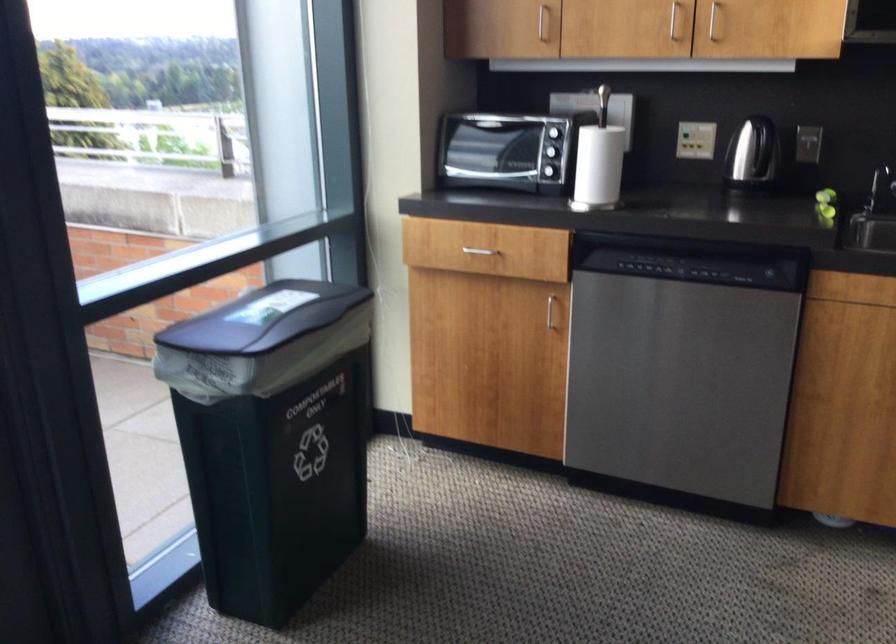
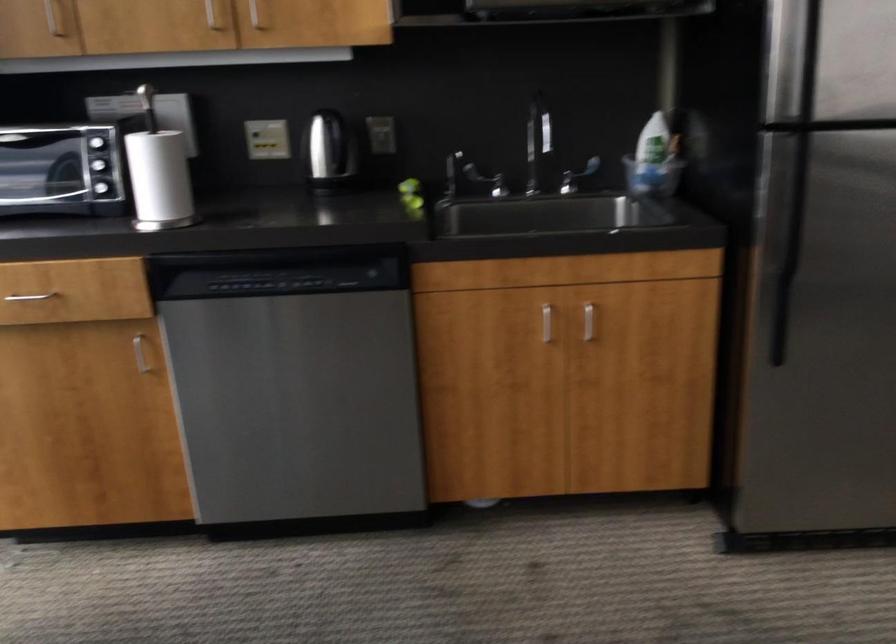
Question: Based on the continuous images, in which direction is the camera rotating? Reply with the corresponding letter.

Choices:
 (A) Left
 (B) Right
 (C) Up
 (D) Down

Answer: (B)